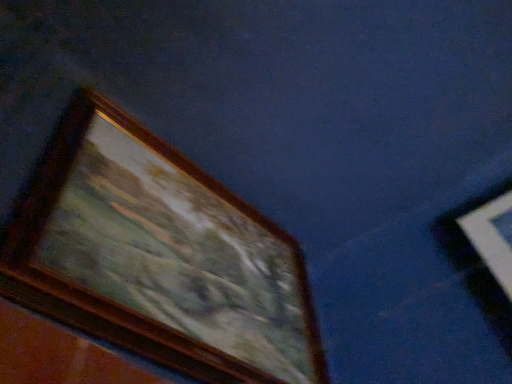
The image size is (512, 384). Find the location of `wooden picture frame at upper left`. wooden picture frame at upper left is located at coordinates (158, 256).

The height and width of the screenshot is (384, 512). Describe the element at coordinates (158, 256) in the screenshot. I see `wooden picture frame at upper left` at that location.

I want to click on wooden picture frame at upper left, so click(158, 256).